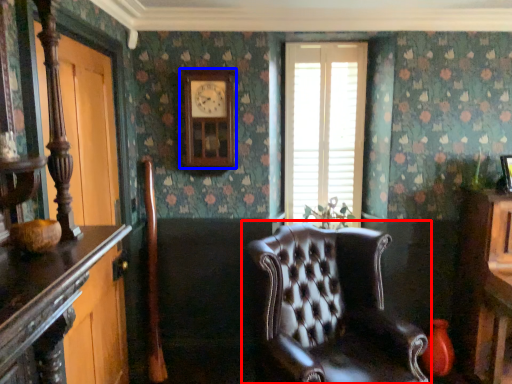
Question: Which point is further to the camera, chair (highlighted by a red box) or clock (highlighted by a blue box)?

Choices:
 (A) chair
 (B) clock

Answer: (B)